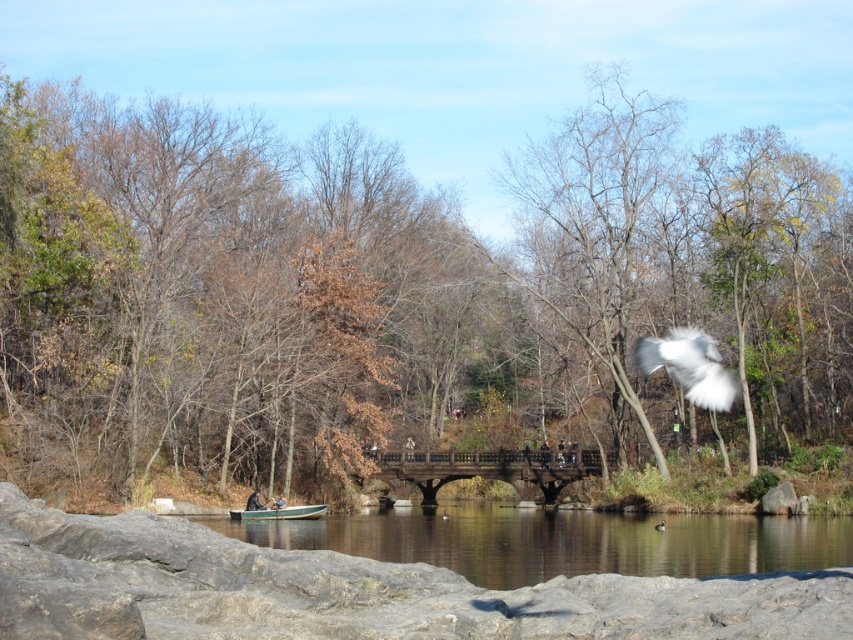
Question: Which of the following is the closest to the observer?

Choices:
 (A) (634, 355)
 (B) (276, 506)
 (C) (730, 308)

Answer: (B)

Question: Can you confirm if brown leafy tree at center is wider than wooden boat at lower center?

Choices:
 (A) yes
 (B) no

Answer: (A)

Question: Which is farther from the wooden boat at lower center?

Choices:
 (A) brown leafy tree at center
 (B) white fluffy bird at upper right

Answer: (B)

Question: Is brown leafy tree at center below wooden boat at lower center?

Choices:
 (A) no
 (B) yes

Answer: (A)

Question: Which point is farther to the camera?

Choices:
 (A) brown leafy tree at center
 (B) white fluffy bird at upper right

Answer: (A)

Question: Is brown leafy tree at center wider than white fluffy bird at upper right?

Choices:
 (A) yes
 (B) no

Answer: (A)